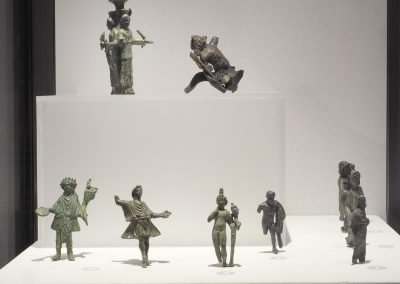
In order to click on figurines in this screenshot , I will do `click(67, 211)`, `click(139, 212)`, `click(219, 218)`, `click(273, 214)`, `click(343, 182)`, `click(353, 193)`, `click(363, 217)`, `click(214, 57)`, `click(121, 44)`.